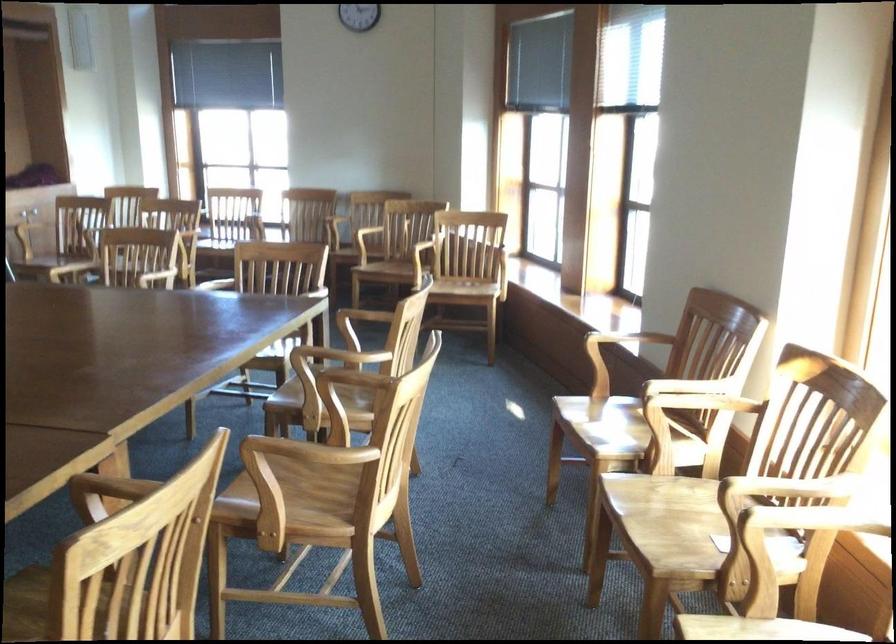
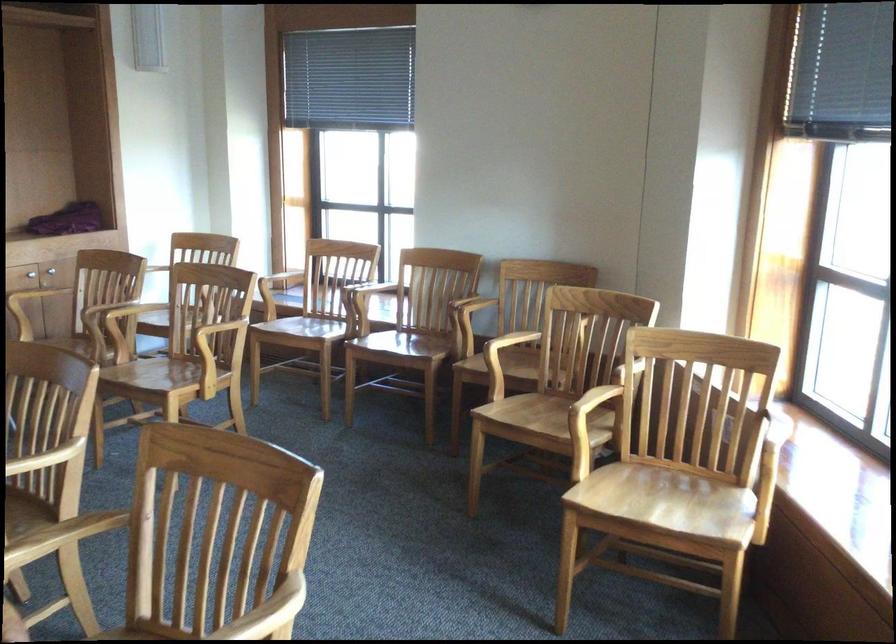
Find the pixel in the second image that matches (x=454, y=285) in the first image.

(670, 502)